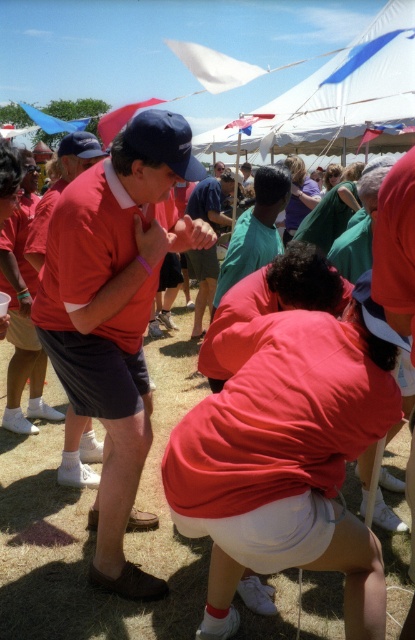
Is point (127, 173) closer to camera compared to point (263, 182)?

Yes, it is in front of point (263, 182).

Measure the distance from matte red shirt at left to teal fabric shirt at center.

matte red shirt at left and teal fabric shirt at center are 96.98 centimeters apart.

Between point (87, 301) and point (236, 243), which one is positioned in front?

Point (87, 301) is in front.

Locate an element on the screen. This screenshot has width=415, height=640. matte red shirt at left is located at coordinates (116, 314).

Between point (288, 320) and point (209, 268), which one is positioned behind?

The point (209, 268) is behind.

How far apart are matte red shirt at center and green cotton shirt at center?

They are 16.54 feet apart.

Locate an element on the screen. The height and width of the screenshot is (640, 415). matte red shirt at center is located at coordinates (285, 445).

I want to click on matte red shirt at center, so click(285, 445).

Based on the photo, between matte red shirt at left and green cotton shirt at center, which one is positioned higher?

green cotton shirt at center

Which is in front, point (95, 524) or point (207, 177)?

Positioned in front is point (95, 524).

The height and width of the screenshot is (640, 415). I want to click on matte red shirt at left, so click(x=116, y=314).